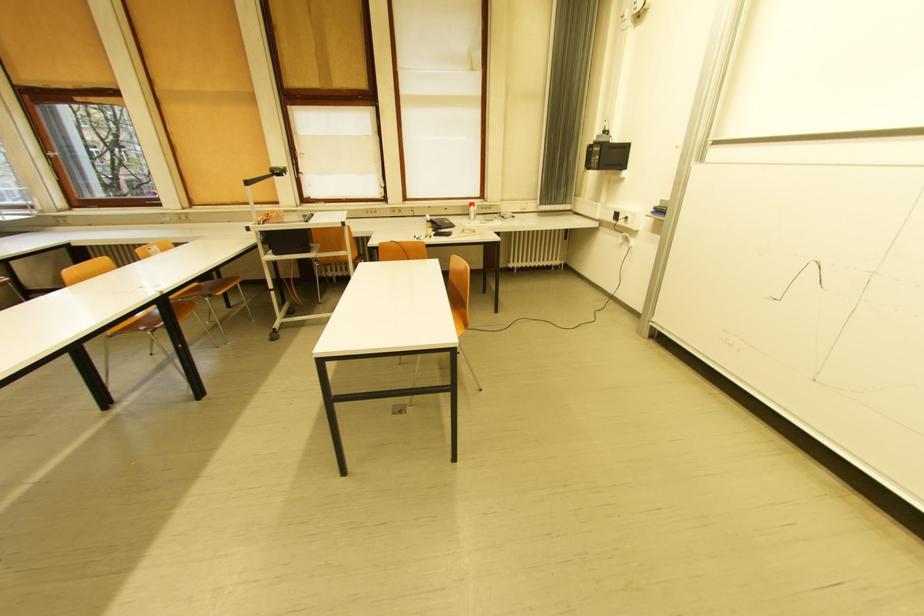
Where would you adjust the projector head? Please return your answer as a coordinate pair (x, y).

(604, 156)